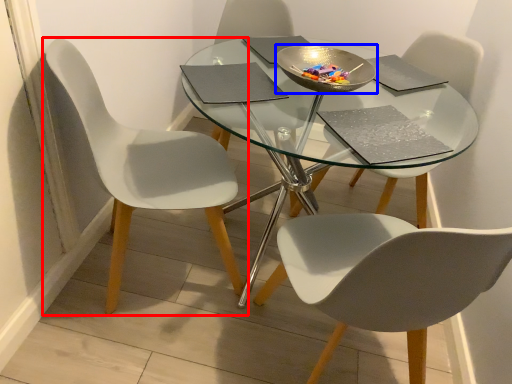
Question: Which point is closer to the camera, chair (highlighted by a red box) or bowl (highlighted by a blue box)?

Choices:
 (A) chair
 (B) bowl

Answer: (A)